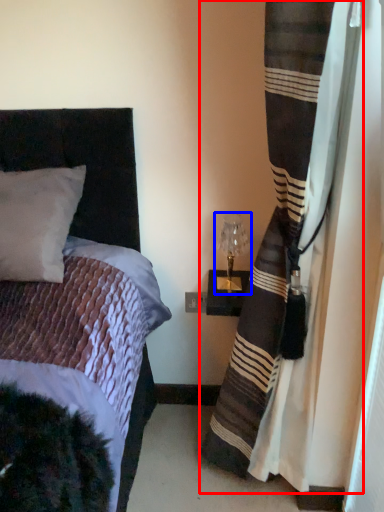
Question: Among these objects, which one is farthest to the camera, curtain (highlighted by a red box) or table lamp (highlighted by a blue box)?

Choices:
 (A) curtain
 (B) table lamp

Answer: (B)